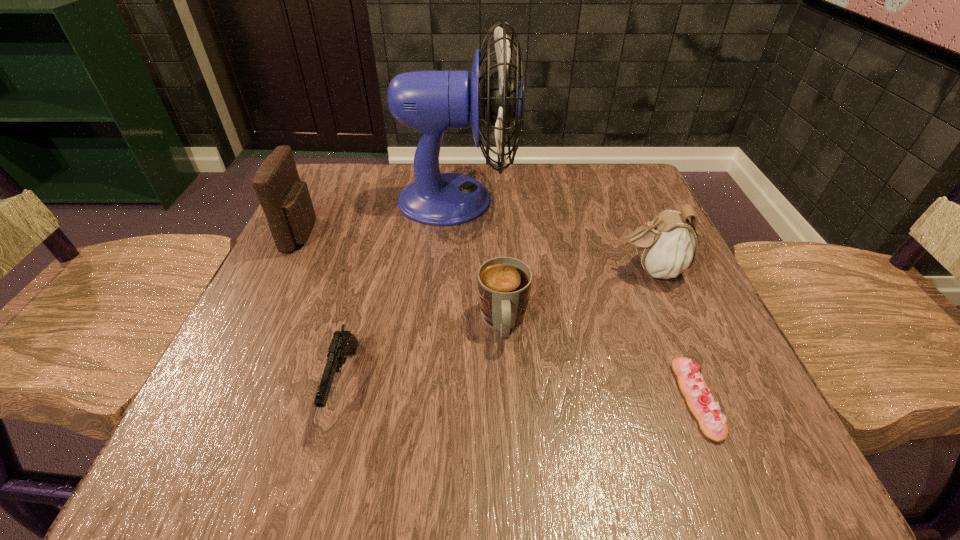
The height and width of the screenshot is (540, 960). I want to click on object present at the left edge, so click(285, 199).

Where is `pouch that is at the right edge`? This screenshot has width=960, height=540. pouch that is at the right edge is located at coordinates (667, 246).

I want to click on eclair at the right edge, so click(x=702, y=404).

Identify the location of object that is at the far left corner. The width and height of the screenshot is (960, 540). (285, 199).

Locate an element on the screen. The height and width of the screenshot is (540, 960). object that is at the near right corner is located at coordinates (702, 404).

Locate an element on the screen. Image resolution: width=960 pixels, height=540 pixels. vacant area at the far edge is located at coordinates (550, 180).

Where is `blank space at the near edge`? blank space at the near edge is located at coordinates (386, 472).

The width and height of the screenshot is (960, 540). What are the coordinates of `free point at the left edge` in the screenshot? It's located at (292, 369).

The height and width of the screenshot is (540, 960). Identify the location of vacant space at the right edge of the desktop. click(642, 293).

Locate an element on the screen. The width and height of the screenshot is (960, 540). vacant space at the far left corner of the desktop is located at coordinates (348, 191).